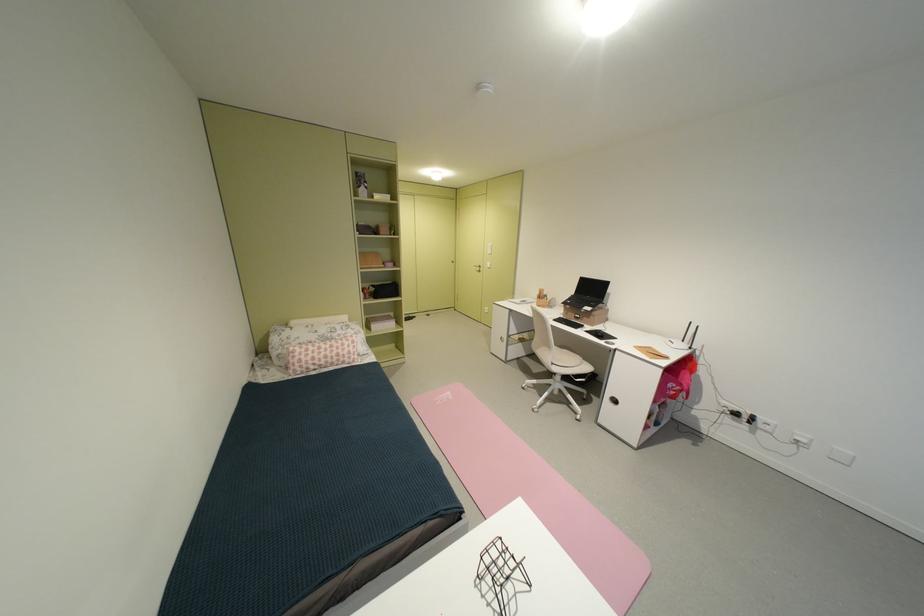
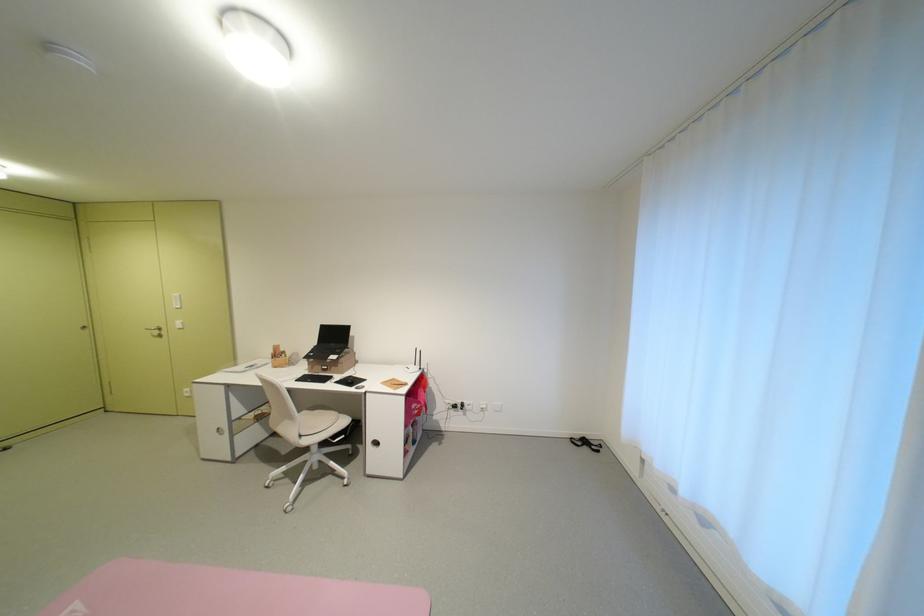
In the second image, find the point that corresponds to point 563,363 in the first image.

(311, 436)